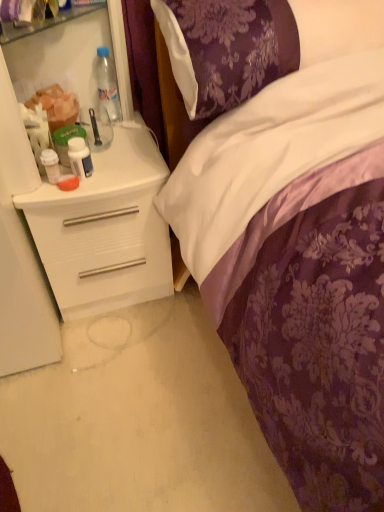
Where is `empty space that is to the right of translucent plastic cup at left`? The width and height of the screenshot is (384, 512). empty space that is to the right of translucent plastic cup at left is located at coordinates (120, 141).